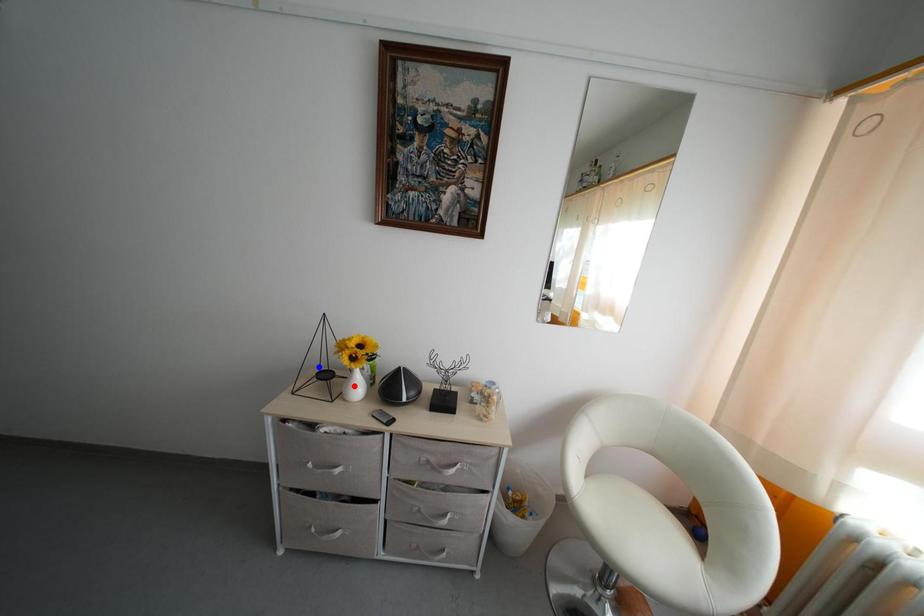
Question: Two points are marked on the image. Which point is closer to the camera?

Choices:
 (A) Blue point is closer.
 (B) Red point is closer.

Answer: (A)